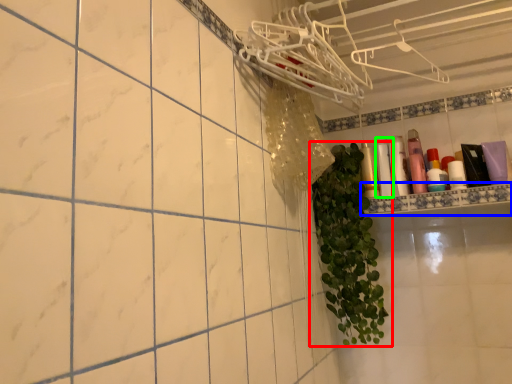
Question: Which object is positioned closest to houseplant (highlighted by a red box)? Select from ledge (highlighted by a blue box) and toiletry (highlighted by a green box).

Choices:
 (A) ledge
 (B) toiletry

Answer: (A)